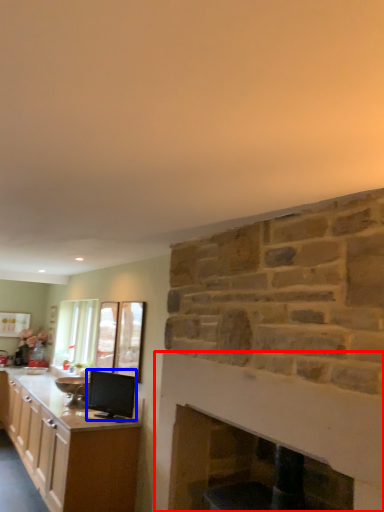
Question: Which of the following is the closest to the observer, fireplace (highlighted by a red box) or appliance (highlighted by a blue box)?

Choices:
 (A) fireplace
 (B) appliance

Answer: (A)